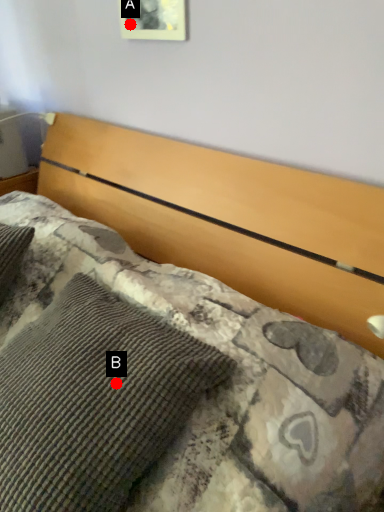
Question: Two points are circled on the image, labeled by A and B beside each circle. Which point is further to the camera?

Choices:
 (A) A is further
 (B) B is further

Answer: (A)